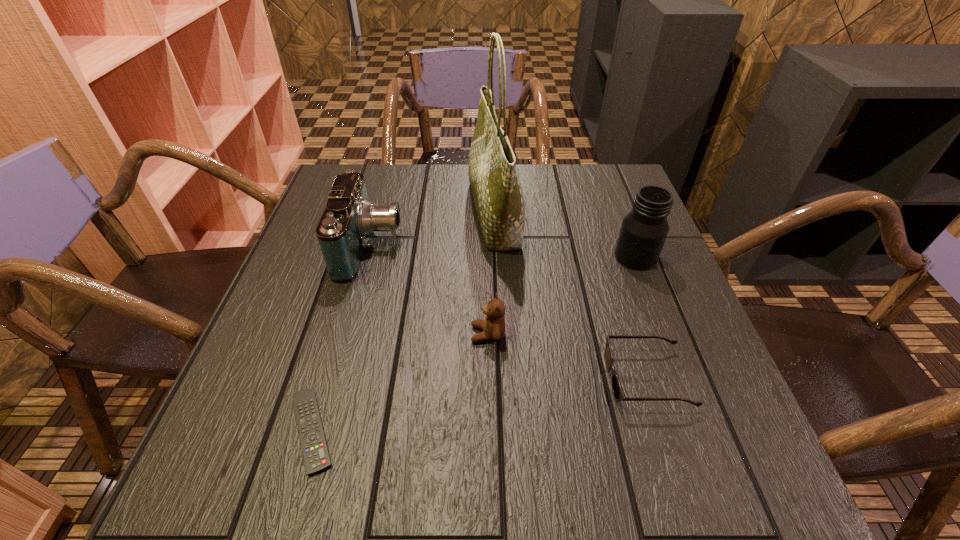
Where is `free spot that satisfies the following two spatial constraints: 1. on the front side of the jar; 2. at the face of the teddy bear`? free spot that satisfies the following two spatial constraints: 1. on the front side of the jar; 2. at the face of the teddy bear is located at coordinates (665, 334).